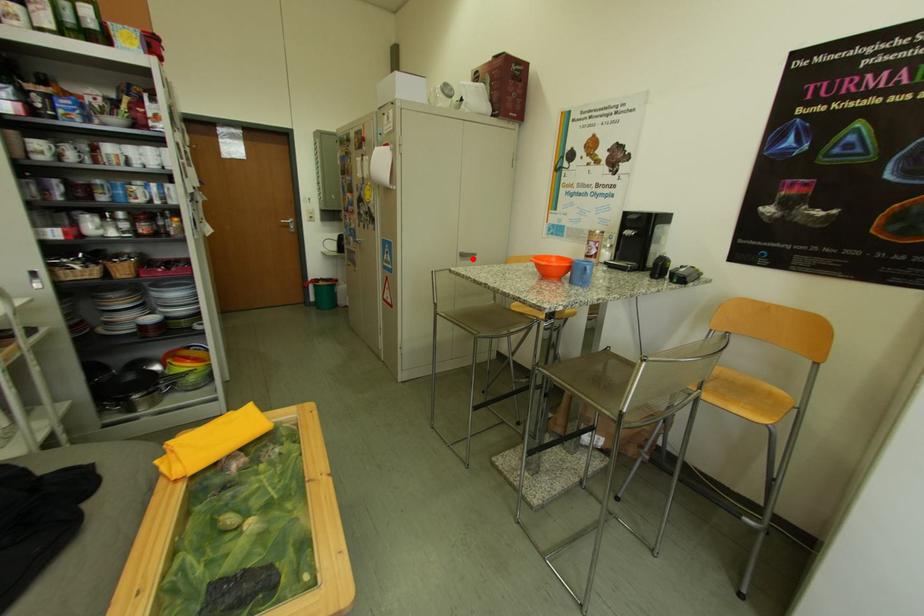
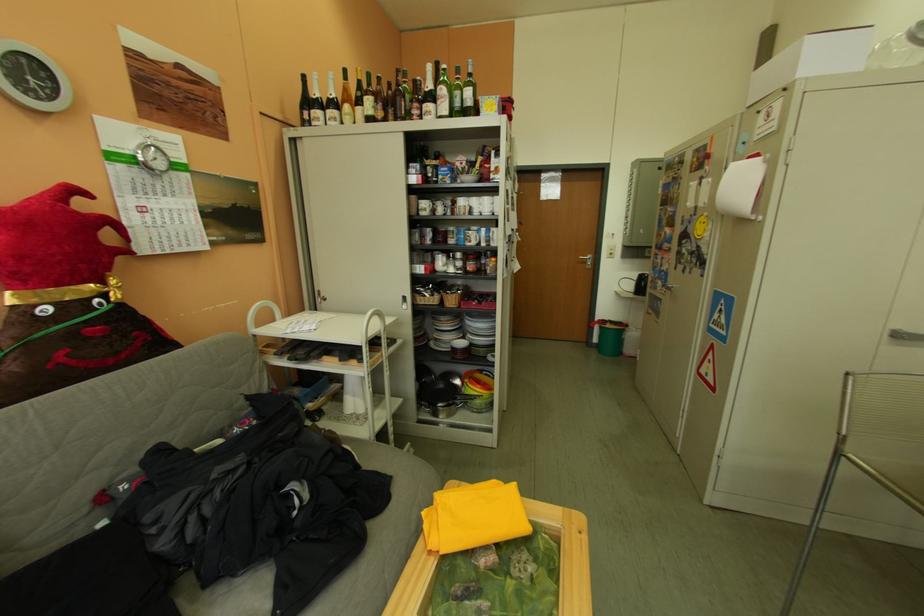
The point at the highlighted location is marked in the first image. Where is the corresponding point in the second image?

(903, 338)